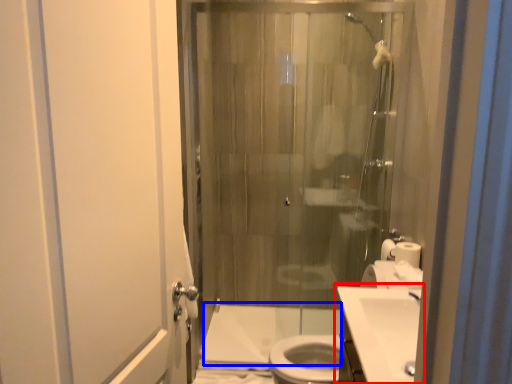
Question: Which object is further to the camera taking this photo, sink (highlighted by a red box) or bath (highlighted by a blue box)?

Choices:
 (A) sink
 (B) bath

Answer: (B)